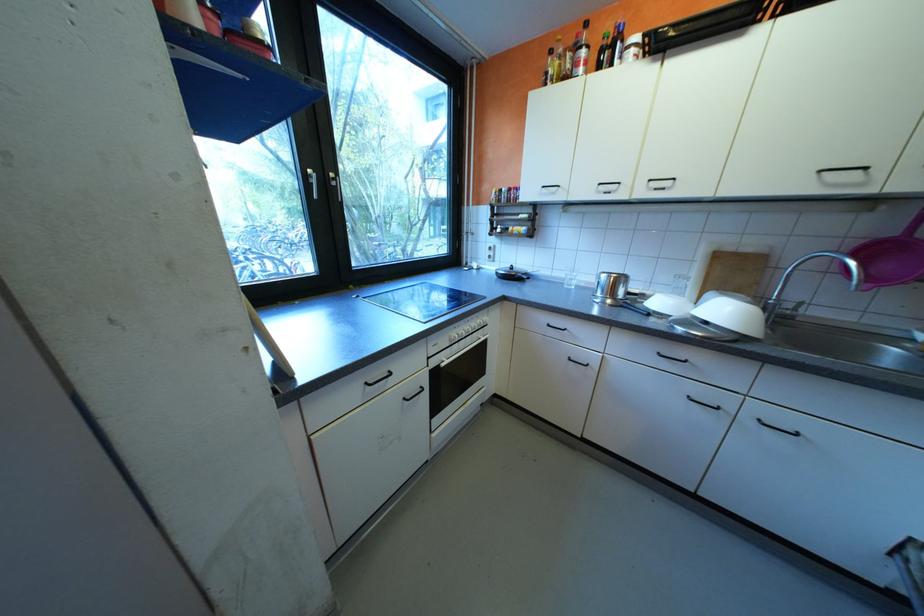
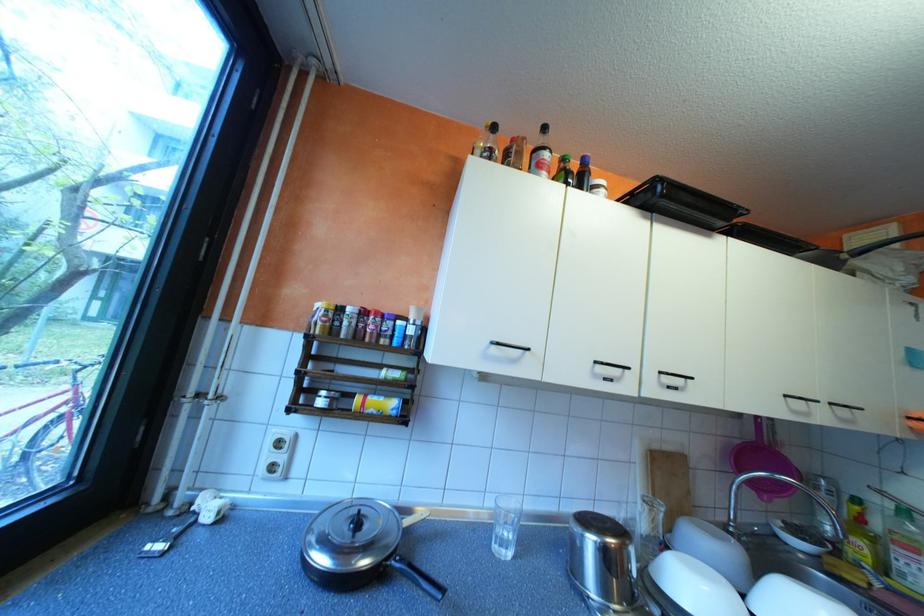
Locate, in the second image, the point that corresponds to pixel 671 302 in the first image.

(709, 592)